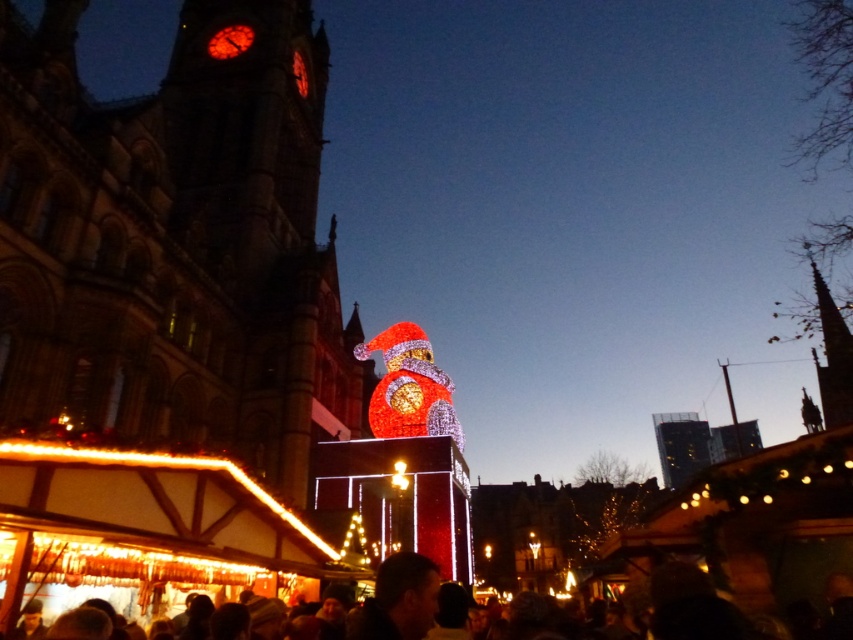
Question: Can you confirm if stone clock tower at upper left is bigger than dark brown hair at lower center?

Choices:
 (A) no
 (B) yes

Answer: (B)

Question: Among these objects, which one is farthest from the camera?

Choices:
 (A) stone clock tower at upper left
 (B) dark brown hair at lower center

Answer: (A)

Question: Is stone clock tower at upper left further to the viewer compared to dark brown hair at lower center?

Choices:
 (A) no
 (B) yes

Answer: (B)

Question: Which point is farther to the camera?

Choices:
 (A) (51, 595)
 (B) (196, 93)

Answer: (B)

Question: Does stone clock tower at upper left appear on the right side of dark brown hair at lower center?

Choices:
 (A) no
 (B) yes

Answer: (A)